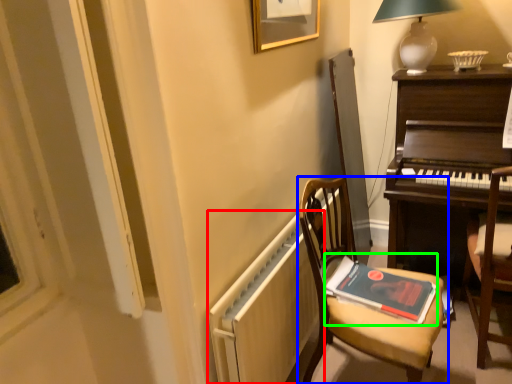
Question: Which object is the closest to the radiator (highlighted by a red box)? Choose among these: chair (highlighted by a blue box) or paperback book (highlighted by a green box).

Choices:
 (A) chair
 (B) paperback book

Answer: (A)